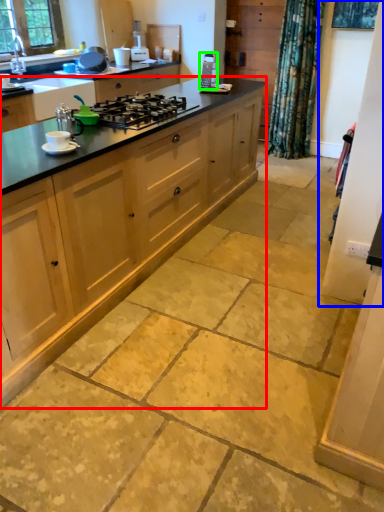
Question: Which object is positioned closest to cabinetry (highlighted by a red box)? Select from screen door (highlighted by a blue box) and appliance (highlighted by a green box).

Choices:
 (A) screen door
 (B) appliance

Answer: (A)